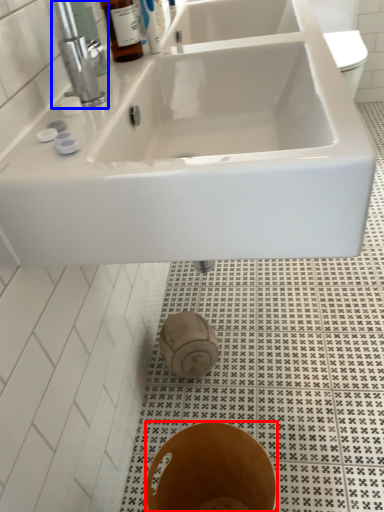
Question: Among these objects, which one is farthest to the camera, bidet (highlighted by a red box) or tap (highlighted by a blue box)?

Choices:
 (A) bidet
 (B) tap

Answer: (B)